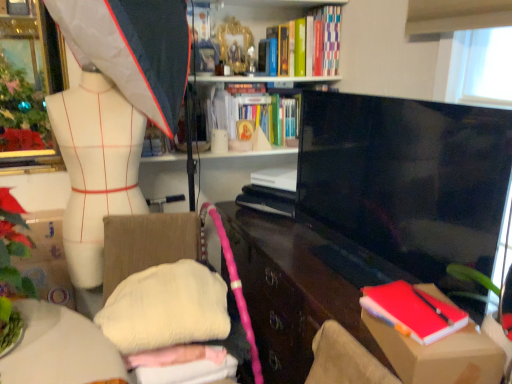
Image resolution: width=512 pixels, height=384 pixels. What do you see at coordinates (96, 167) in the screenshot?
I see `white matte mannequin torso at left` at bounding box center [96, 167].

What do you see at coordinates (413, 311) in the screenshot? This screenshot has height=384, width=512. I see `matte red notebook at lower right, which is the third book from top to bottom` at bounding box center [413, 311].

Measure the distance between point (x=15, y=220) and camera.

Point (x=15, y=220) and camera are 1.17 meters apart from each other.

What is the approximate width of cardboard box at lower right?

The width of cardboard box at lower right is 8.93 inches.

Identify the location of white matte mannequin torso at left. This screenshot has width=512, height=384. (96, 167).

At what (x,y) coordinates should I click in order to perform the action: click on furniture below the white matte mannequin torso at left (from the image's perspective). Please return your answer as a coordinate pair (x, y). Looking at the image, I should click on (60, 349).

Based on their sizes in the image, would you say white matte mannequin torso at left is bigger or smaller than white soft cushion at center?

Clearly, white matte mannequin torso at left is smaller in size than white soft cushion at center.

Would you say white matte mannequin torso at left is a long distance from white soft cushion at center?

That's not correct — white matte mannequin torso at left is a little close to white soft cushion at center.

How many degrees apart are the facing directions of matte red notebook at lower right, which is the third book from top to bottom, and green matte book at upper center, which is counted as the first book, starting from the top?

There is a 79.2-degree angle between the facing directions of matte red notebook at lower right, which is the third book from top to bottom, and green matte book at upper center, which is counted as the first book, starting from the top.

Which object is closer to the camera taking this photo, matte red notebook at lower right, placed as the first book when sorted from bottom to top, or green matte book at upper center, which is counted as the first book, starting from the top?

matte red notebook at lower right, placed as the first book when sorted from bottom to top, is more forward.

Is point (387, 302) positioned in front of point (303, 48)?

Yes, point (387, 302) is in front of point (303, 48).

Is matte red notebook at lower right, which is the third book from top to bottom, to the left or to the right of green matte book at upper center, the 2th book in the front-to-back sequence, in the image?

matte red notebook at lower right, which is the third book from top to bottom, is positioned on green matte book at upper center, the 2th book in the front-to-back sequence,'s right side.

Would you say green matte book at upper center, the 2th book in the front-to-back sequence, is to the left or to the right of hardcover book at upper center, positioned as the third book in front-to-back order, in the picture?

Clearly, green matte book at upper center, the 2th book in the front-to-back sequence, is on the right of hardcover book at upper center, positioned as the third book in front-to-back order, in the image.

In the scene shown: Can hardcover book at upper center, positioned as the third book in front-to-back order, be found inside green matte book at upper center, the 3th book when ordered from bottom to top?

Actually, hardcover book at upper center, positioned as the third book in front-to-back order, is outside green matte book at upper center, the 3th book when ordered from bottom to top.

Is green matte book at upper center, the 3th book when ordered from bottom to top, wider or thinner than hardcover book at upper center, positioned as the third book in front-to-back order?

Clearly, green matte book at upper center, the 3th book when ordered from bottom to top, has more width compared to hardcover book at upper center, positioned as the third book in front-to-back order.

Looking at this image, are green matte book at upper center, the 2th book in the front-to-back sequence, and hardcover book at upper center, positioned as the 2th book in top-to-bottom order, beside each other?

green matte book at upper center, the 2th book in the front-to-back sequence, and hardcover book at upper center, positioned as the 2th book in top-to-bottom order, are not in contact.

Between black glossy tv at right and hardcover book at upper center, positioned as the 2th book in top-to-bottom order, which one has larger size?

black glossy tv at right.

Which is more to the left, black glossy tv at right or hardcover book at upper center, positioned as the 1th book in back-to-front order?

From the viewer's perspective, hardcover book at upper center, positioned as the 1th book in back-to-front order, appears more on the left side.

Is black glossy tv at right not close to hardcover book at upper center, positioned as the third book in front-to-back order?

No, black glossy tv at right is not far away from hardcover book at upper center, positioned as the third book in front-to-back order.

Which object is closer to the camera taking this photo, black glossy tv at right or hardcover book at upper center, which ranks as the 2th book in bottom-to-top order?

black glossy tv at right is closer to the camera.

Are green matte book at upper center, the 3th book when ordered from bottom to top, and black glossy tv at right beside each other?

No, green matte book at upper center, the 3th book when ordered from bottom to top, is not next to black glossy tv at right.

Do you think green matte book at upper center, which is counted as the first book, starting from the top, is within black glossy tv at right, or outside of it?

The correct answer is: outside.

Is green matte book at upper center, the second book in the back-to-front sequence, turned away from black glossy tv at right?

No, black glossy tv at right is not at the back of green matte book at upper center, the second book in the back-to-front sequence.

From the image's perspective, which one is positioned higher, green matte book at upper center, the second book in the back-to-front sequence, or black glossy tv at right?

From the image's view, green matte book at upper center, the second book in the back-to-front sequence, is above.

Which object is thinner, matte red notebook at lower right, placed as the 1th book when sorted from front to back, or green leafy plant at left?

matte red notebook at lower right, placed as the 1th book when sorted from front to back.

From the image's perspective, which is below, matte red notebook at lower right, placed as the first book when sorted from bottom to top, or green leafy plant at left?

From the image's view, matte red notebook at lower right, placed as the first book when sorted from bottom to top, is below.

Is matte red notebook at lower right, placed as the first book when sorted from bottom to top, in contact with green leafy plant at left?

No, matte red notebook at lower right, placed as the first book when sorted from bottom to top, is not beside green leafy plant at left.

Can you confirm if white matte mannequin torso at left is taller than hardcover book at upper center, positioned as the 1th book in back-to-front order?

Indeed, white matte mannequin torso at left has a greater height compared to hardcover book at upper center, positioned as the 1th book in back-to-front order.

How distant is white matte mannequin torso at left from hardcover book at upper center, which ranks as the 2th book in bottom-to-top order?

26.27 inches.

Would you say white matte mannequin torso at left contains hardcover book at upper center, positioned as the third book in front-to-back order?

No.

From the image's perspective, is white matte mannequin torso at left located beneath hardcover book at upper center, positioned as the third book in front-to-back order?

Yes, from the image's perspective, white matte mannequin torso at left is below hardcover book at upper center, positioned as the third book in front-to-back order.

Where is `clothing that is behind the white soft cushion at center`? clothing that is behind the white soft cushion at center is located at coordinates (96, 167).

Where is `book on the right of green matte book at upper center, the 3th book when ordered from bottom to top`? This screenshot has height=384, width=512. book on the right of green matte book at upper center, the 3th book when ordered from bottom to top is located at coordinates (413, 311).

Considering their positions, is black glossy tv at right positioned closer to white soft cushion at center than green matte book at upper center, the 2th book in the front-to-back sequence?

black glossy tv at right is closer to white soft cushion at center.

When comparing their distances from matte red notebook at lower right, placed as the first book when sorted from bottom to top, does cardboard box at lower right or matte black cabinet at center seem further?

matte black cabinet at center is positioned further to the anchor matte red notebook at lower right, placed as the first book when sorted from bottom to top.

Estimate the real-world distances between objects in this image. Which object is further from black glossy tv at right, green matte book at upper center, the 2th book in the front-to-back sequence, or hardcover book at upper center, which ranks as the 2th book in bottom-to-top order?

Among the two, green matte book at upper center, the 2th book in the front-to-back sequence, is located further to black glossy tv at right.

Which object lies nearer to the anchor point hardcover book at upper center, positioned as the 2th book in top-to-bottom order, white soft cushion at center or cardboard box at lower right?

white soft cushion at center is positioned closer to the anchor hardcover book at upper center, positioned as the 2th book in top-to-bottom order.

When comparing their distances from hardcover book at upper center, positioned as the 1th book in back-to-front order, does green leafy plant at left or white soft cushion at center seem closer?

green leafy plant at left lies closer to hardcover book at upper center, positioned as the 1th book in back-to-front order, than the other object.

When comparing their distances from black glossy tv at right, does white soft cushion at center or cardboard box at lower right seem further?

Based on the image, white soft cushion at center appears to be further to black glossy tv at right.

From the image, which object appears to be nearer to green matte book at upper center, the second book in the back-to-front sequence, white matte mannequin torso at left or cardboard box at lower right?

white matte mannequin torso at left.

Looking at this image, which object lies further to the anchor point green leafy plant at left, black glossy tv at right or green matte book at upper center, the 2th book in the front-to-back sequence?

The object further to green leafy plant at left is green matte book at upper center, the 2th book in the front-to-back sequence.

Where is `television between white soft cushion at center and matte red notebook at lower right, which is the third book from top to bottom, from left to right`? Image resolution: width=512 pixels, height=384 pixels. television between white soft cushion at center and matte red notebook at lower right, which is the third book from top to bottom, from left to right is located at coordinates (406, 187).

Locate an element on the screen. Image resolution: width=512 pixels, height=384 pixels. clothing that lies between hardcover book at upper center, positioned as the 2th book in top-to-bottom order, and matte black cabinet at center from top to bottom is located at coordinates (96, 167).

Find the location of `cabinetry between green leafy plant at left and matte red notebook at lower right, the third book in the back-to-front sequence`. cabinetry between green leafy plant at left and matte red notebook at lower right, the third book in the back-to-front sequence is located at coordinates (300, 285).

At what (x,y) coordinates should I click in order to perform the action: click on cardboard box located between green leafy plant at left and green matte book at upper center, which is counted as the first book, starting from the top, in the depth direction. Please return your answer as a coordinate pair (x, y). Looking at the image, I should click on (440, 355).